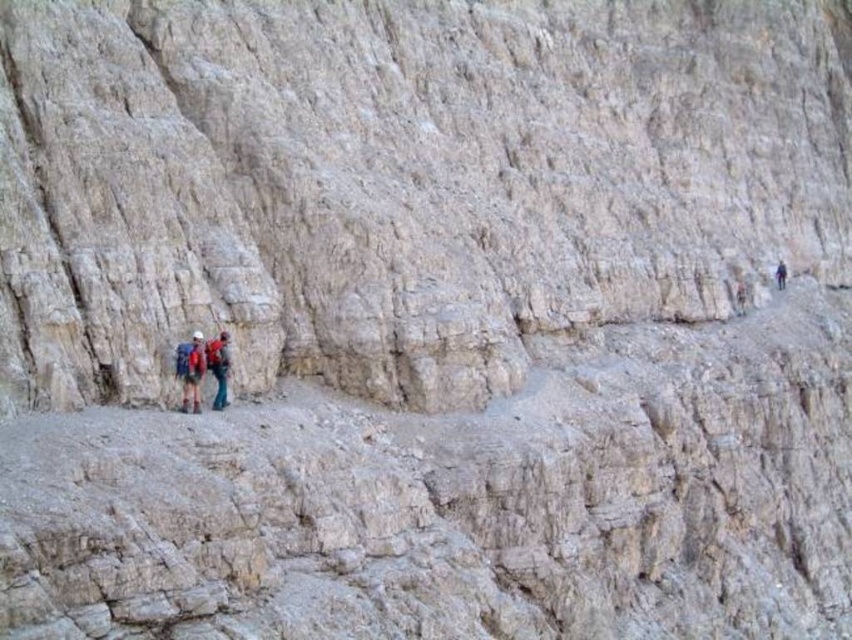
Can you confirm if red fabric backpack at center is positioned above dark blue fabric backpack at right?

Actually, red fabric backpack at center is below dark blue fabric backpack at right.

This screenshot has height=640, width=852. Describe the element at coordinates (217, 368) in the screenshot. I see `red fabric backpack at center` at that location.

The width and height of the screenshot is (852, 640). What are the coordinates of `red fabric backpack at center` in the screenshot? It's located at (217, 368).

Looking at this image, who is more forward, (186, 404) or (219, 352)?

Point (186, 404) is more forward.

Is point (185, 390) positioned behind point (214, 403)?

No, (185, 390) is closer to viewer.

Between point (208, 355) and point (219, 401), which one is positioned in front?

Point (219, 401) is in front.

Where is `matte red backpacks at center`? The height and width of the screenshot is (640, 852). matte red backpacks at center is located at coordinates (200, 368).

Between matte red backpacks at center and dark blue fabric backpack at right, which one is positioned higher?

Positioned higher is dark blue fabric backpack at right.

Is point (202, 372) less distant than point (776, 284)?

Yes, it is in front of point (776, 284).

Locate an element on the screen. matte red backpacks at center is located at coordinates (200, 368).